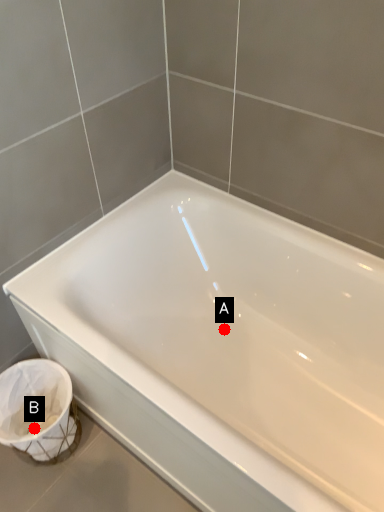
Question: Two points are circled on the image, labeled by A and B beside each circle. Which point is further to the camera?

Choices:
 (A) A is further
 (B) B is further

Answer: (A)